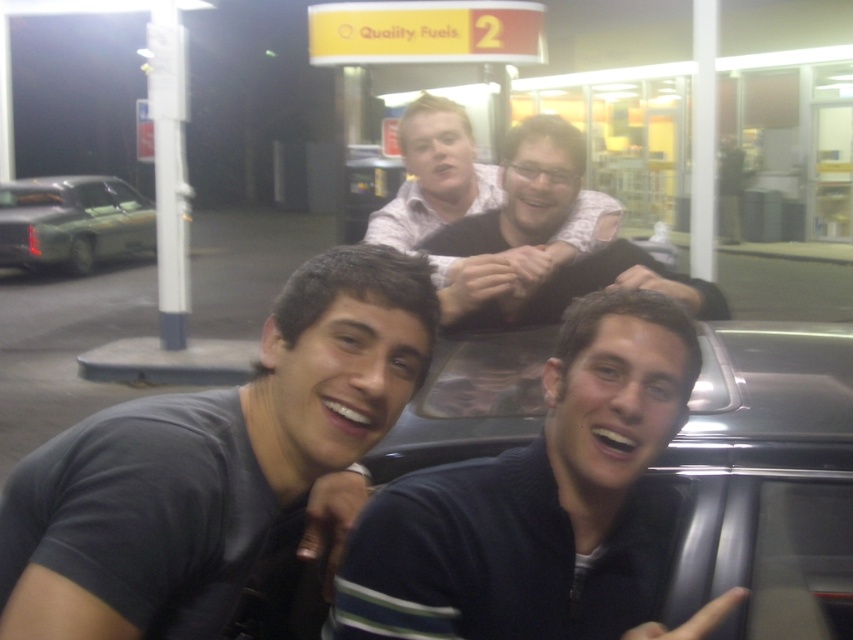
You are a photographer trying to adjust the lighting for a group photo at a gas station. You notice two people in the foreground wearing a dark blue sweater at center and a matte black shirt at upper center. Which clothing item is smaller in size?

The dark blue sweater at center has a smaller size compared to the matte black shirt at upper center.